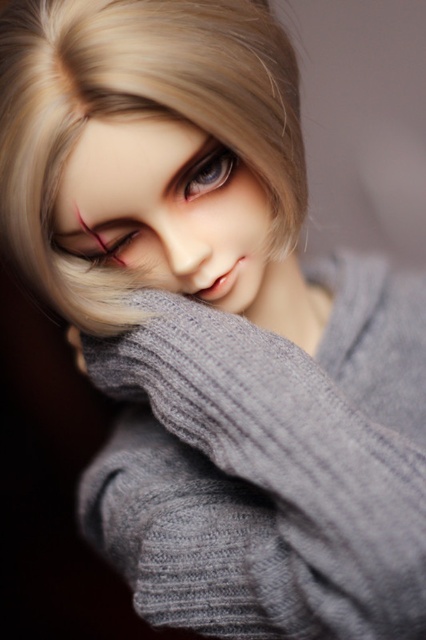
You are a photographer adjusting your camera settings to capture a detailed closeup of the subject. The camera lens has a focal length of 85mm. Knowing that the blondehair at upper center is 16.44 inches away from the viewer, can you confirm if the distance is within the recommended 18 inches minimum for this lens to avoid distortion?

The blondehair at upper center is 16.44 inches away from the viewer, which is less than the recommended 18 inches minimum distance for the 85mm lens to avoid distortion. Therefore, moving back slightly would help achieve a distortionless image.

You are a photographer adjusting the lighting for a portrait. You notice the blondehair at upper center and the matte black eye at center in your frame. Which object should you adjust the light to highlight first if you want to ensure both are well lit, considering their positions?

The matte black eye at center should be highlighted first because the blondehair at upper center is positioned on the right side of it, meaning adjusting the light for the eye first ensures proper illumination before addressing the hair.

You are a photographer adjusting the camera focus. You notice the blondehair at upper center and the matte gray doll face at upper center in the frame. Which object should you focus on to ensure the subject is sharp?

The blondehair at upper center is in front of the matte gray doll face at upper center, so focusing on the blondehair at upper center will ensure the subject is sharp.